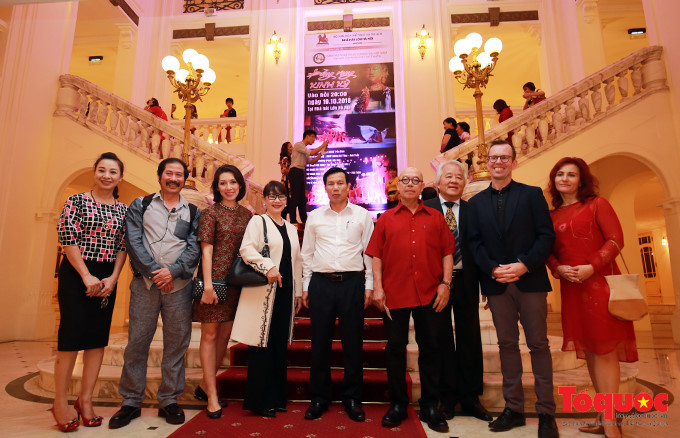
Where is `globe lights`? Image resolution: width=680 pixels, height=438 pixels. globe lights is located at coordinates (197, 66), (473, 68).